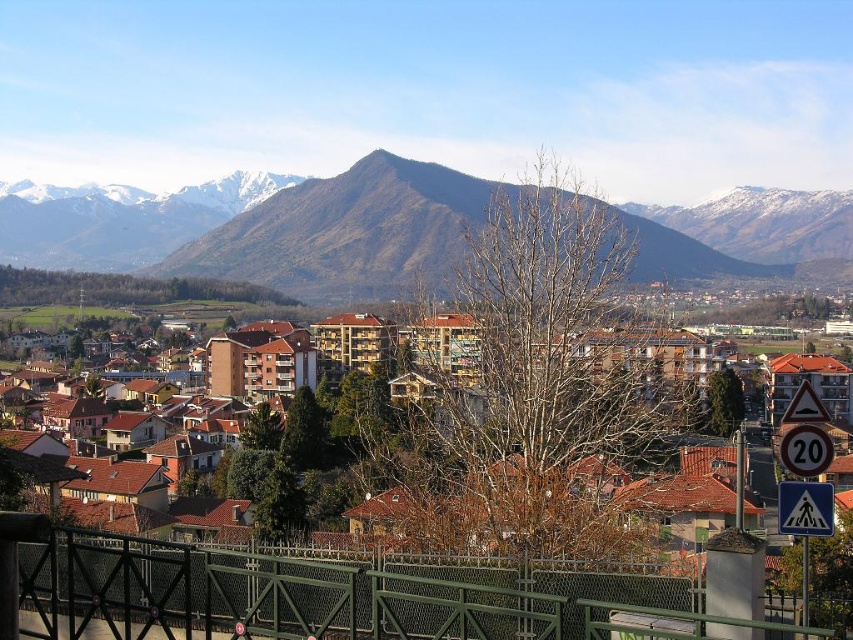
Is brown tiled roofs at center wider than white plastic speed limit sign at right?

Yes.

Does point (525, 515) come behind point (802, 524)?

That is True.

Is point (511, 522) positioned in front of point (798, 506)?

No, it is not.

Image resolution: width=853 pixels, height=640 pixels. In order to click on brown tiled roofs at center in this screenshot , I will do `click(537, 500)`.

In the scene shown: Measure the distance between point (671, 244) and camera.

Point (671, 244) and camera are 1706.44 feet apart.

Between snow-covered mountain range at center and white plastic pedestrian crossing sign at lower right, which one has more height?

snow-covered mountain range at center

Where is `snow-covered mountain range at center`? The image size is (853, 640). snow-covered mountain range at center is located at coordinates (264, 228).

This screenshot has height=640, width=853. I want to click on snow-covered mountain range at center, so click(x=264, y=228).

Identify the location of brown tiled roofs at center. (537, 500).

This screenshot has width=853, height=640. What do you see at coordinates (537, 500) in the screenshot? I see `brown tiled roofs at center` at bounding box center [537, 500].

The height and width of the screenshot is (640, 853). What do you see at coordinates (537, 500) in the screenshot?
I see `brown tiled roofs at center` at bounding box center [537, 500].

Find the location of `brown tiled roofs at center`. brown tiled roofs at center is located at coordinates (537, 500).